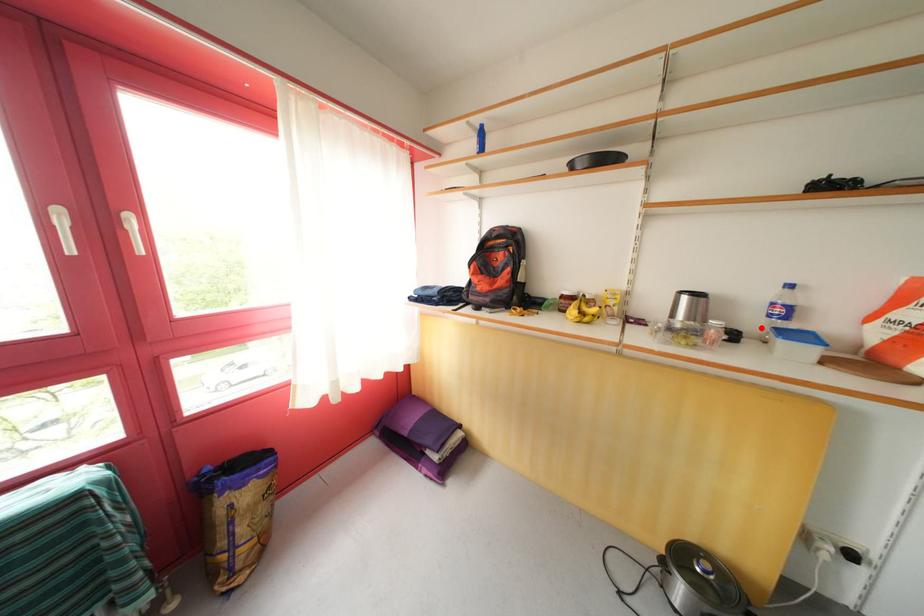
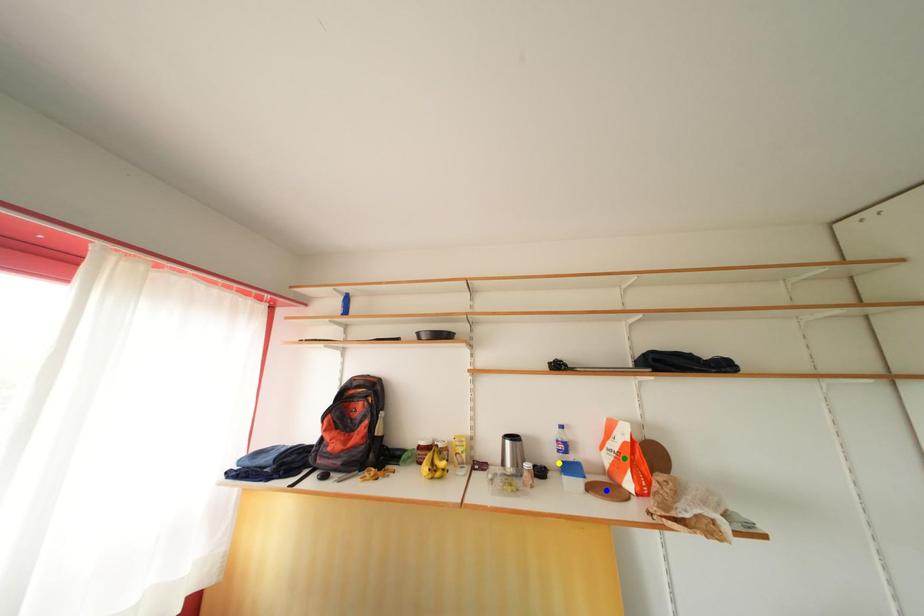
Question: I am providing you with two images of the same scene from different viewpoints. A red point is marked on the first image. You are given multiple points on the second image. Which mark in image 2 goes with the point in image 1?

Choices:
 (A) green point
 (B) blue point
 (C) yellow point

Answer: (C)